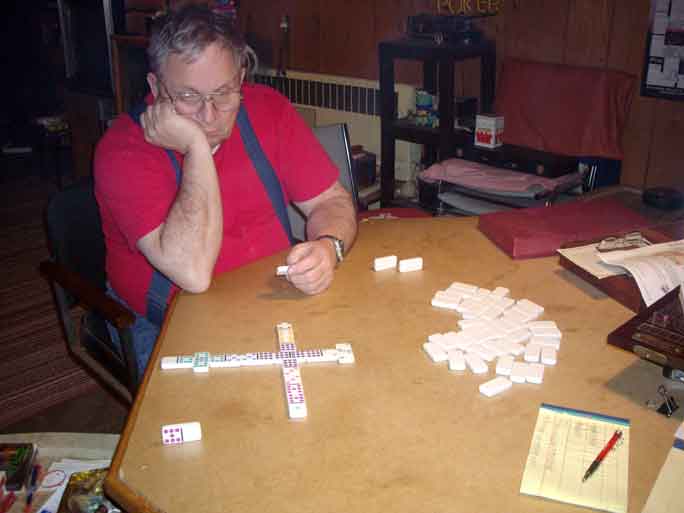
Identify the location of rug. (49, 353).